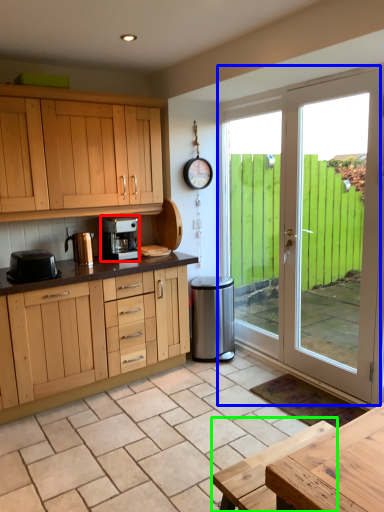
Question: Which object is the farthest from kitchen appliance (highlighted by a red box)? Choose among these: door (highlighted by a blue box) or table (highlighted by a green box).

Choices:
 (A) door
 (B) table

Answer: (B)